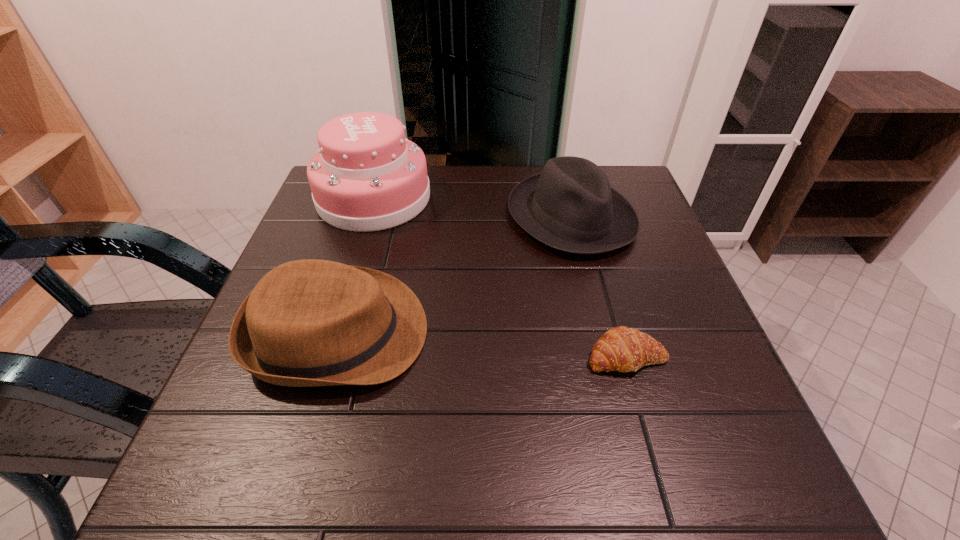
I want to click on vacant area that lies between the nearer fedora and the crescent roll, so click(482, 345).

Locate an element on the screen. The width and height of the screenshot is (960, 540). free space between the shortest object and the left fedora is located at coordinates (482, 345).

Locate an element on the screen. The height and width of the screenshot is (540, 960). empty location between the nearer fedora and the crescent roll is located at coordinates (482, 345).

Locate an element on the screen. This screenshot has height=540, width=960. vacant area that lies between the farther fedora and the shortest object is located at coordinates (599, 287).

The width and height of the screenshot is (960, 540). I want to click on blank region between the shortest object and the nearer fedora, so click(x=482, y=345).

Where is `vacant space in between the shortest object and the right fedora`? Image resolution: width=960 pixels, height=540 pixels. vacant space in between the shortest object and the right fedora is located at coordinates (599, 287).

Locate an element on the screen. The width and height of the screenshot is (960, 540). empty space that is in between the shortest object and the left fedora is located at coordinates (x=482, y=345).

Locate an element on the screen. The image size is (960, 540). vacant area that lies between the left fedora and the tallest object is located at coordinates (356, 265).

The image size is (960, 540). Find the location of `empty space that is in between the right fedora and the shortest object`. empty space that is in between the right fedora and the shortest object is located at coordinates (599, 287).

Find the location of a particular element. The height and width of the screenshot is (540, 960). vacant area that lies between the farther fedora and the cake is located at coordinates (472, 207).